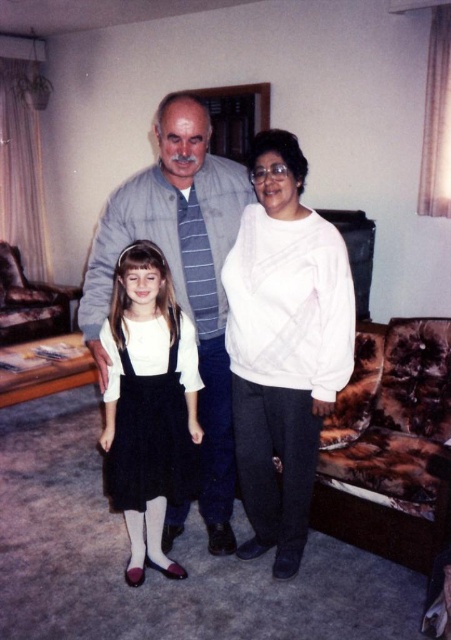
You are a photographer setting up for a family portrait. You need to position the gray striped shirt at center and the brown fur couch at left in such a way that the couch is not blocking the view of the shirt. Based on the scene description, is the current arrangement suitable?

The gray striped shirt at center is to the right of the brown fur couch at left, meaning the couch is positioned to the left of the shirt. Since the couch is on the left and the shirt is to its right, the couch does not block the view of the gray striped shirt at center as they are arranged side by side horizontally.

You are a guest at a party and want to sit on the brown fur couch at left. However, you are wearing a white matte dress at center. Is there enough space for you to sit comfortably without touching the dress?

The white matte dress at center is thinner than the brown fur couch at left, so there should be enough space to sit comfortably on the brown fur couch at left without touching the dress.

You are a photographer setting up a shoot in this living room. You need to position a light source so that it illuminates the gray striped shirt at center without casting a shadow on the brown fur couch at left. Based on their positions, where should you place the light source?

The gray striped shirt at center is in front of the brown fur couch at left, so placing the light source behind the gray striped shirt at center would cast its shadow forward away from the couch. Alternatively, positioning the light directly in front of the shirt and angled downward ensures light reaches the shirt while avoiding the couch behind it.